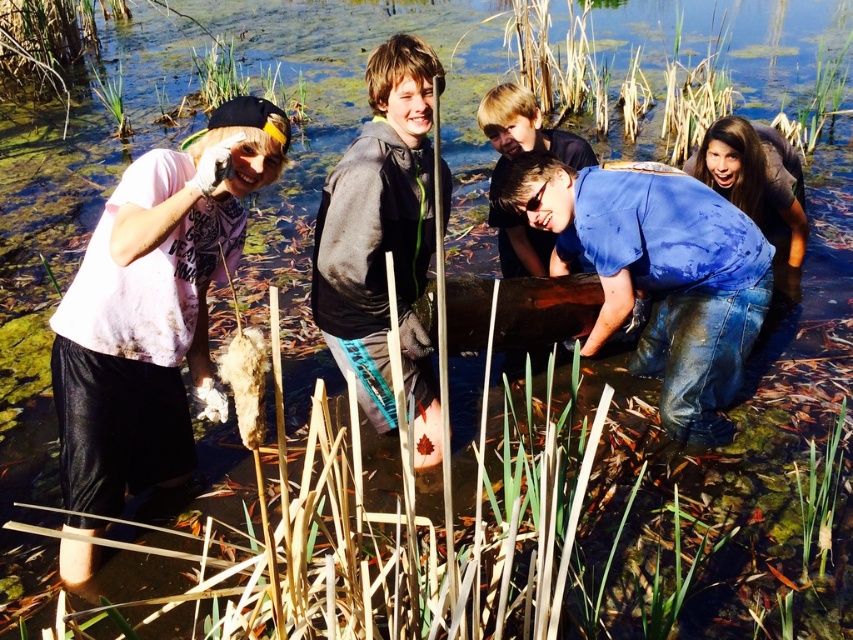
You are a photographer standing at the edge of the wetland area. You want to take a photo that includes both the blue denim jeans at lower right and the dark gray fleece jacket at center. Which object will appear smaller in the photo?

The blue denim jeans at lower right will appear smaller in the photo because it is not as tall as the dark gray fleece jacket at center.